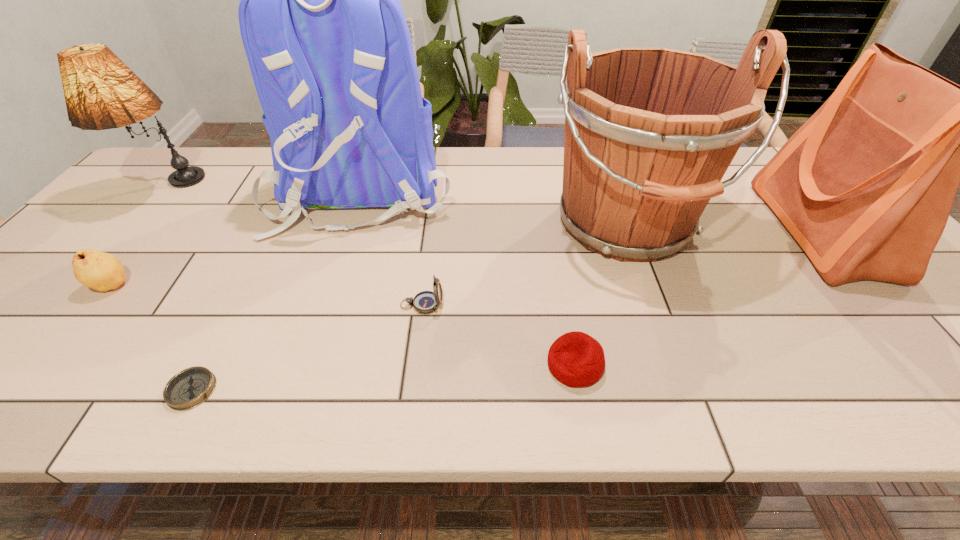
Where is `vacant area situated 0.190m on the seat area of the seventh tallest object`? The height and width of the screenshot is (540, 960). vacant area situated 0.190m on the seat area of the seventh tallest object is located at coordinates (452, 364).

This screenshot has height=540, width=960. Find the location of `free space located on the left of the nearer compass`. free space located on the left of the nearer compass is located at coordinates (101, 390).

Locate an element on the screen. The width and height of the screenshot is (960, 540). backpack present at the far edge is located at coordinates (x=329, y=49).

The image size is (960, 540). Find the location of `bucket positioned at the far edge`. bucket positioned at the far edge is located at coordinates (649, 132).

Where is `shopping bag at the far edge`? This screenshot has width=960, height=540. shopping bag at the far edge is located at coordinates (865, 186).

Image resolution: width=960 pixels, height=540 pixels. What are the coordinates of `lampshade that is at the far edge` in the screenshot? It's located at (101, 92).

This screenshot has height=540, width=960. I want to click on beanbag positioned at the near edge, so click(x=575, y=359).

Locate an element on the screen. compass present at the near edge is located at coordinates pyautogui.click(x=189, y=388).

At what (x,y) coordinates should I click in order to perform the action: click on lampshade present at the left edge. Please return your answer as a coordinate pair (x, y). Image resolution: width=960 pixels, height=540 pixels. Looking at the image, I should click on (101, 92).

You are a GUI agent. You are given a task and a screenshot of the screen. Output one action in this format:
    pyautogui.click(x=<x>, y=<y>)
    Task: Click on the pear that is at the left edge
    This screenshot has width=960, height=540.
    Given the screenshot: What is the action you would take?
    pyautogui.click(x=101, y=271)